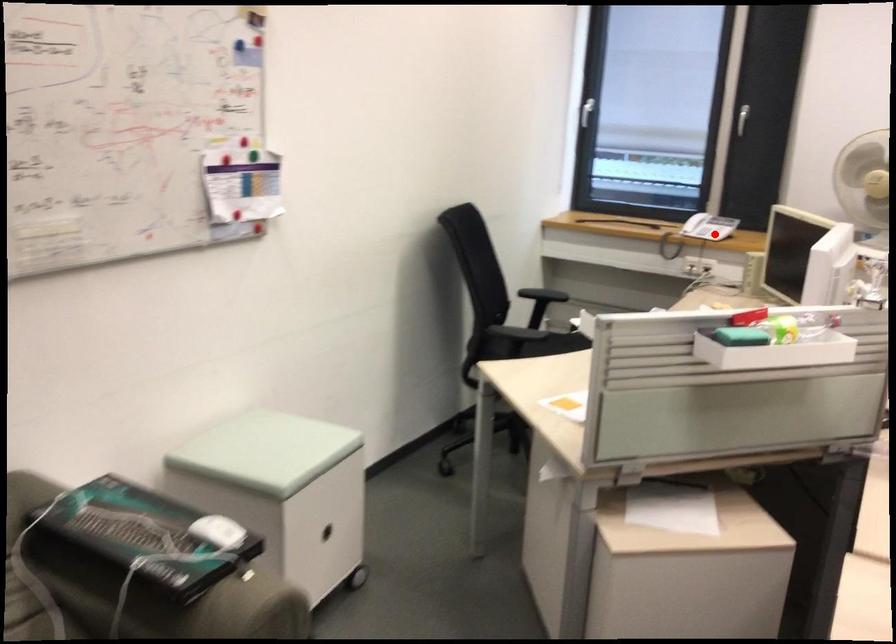
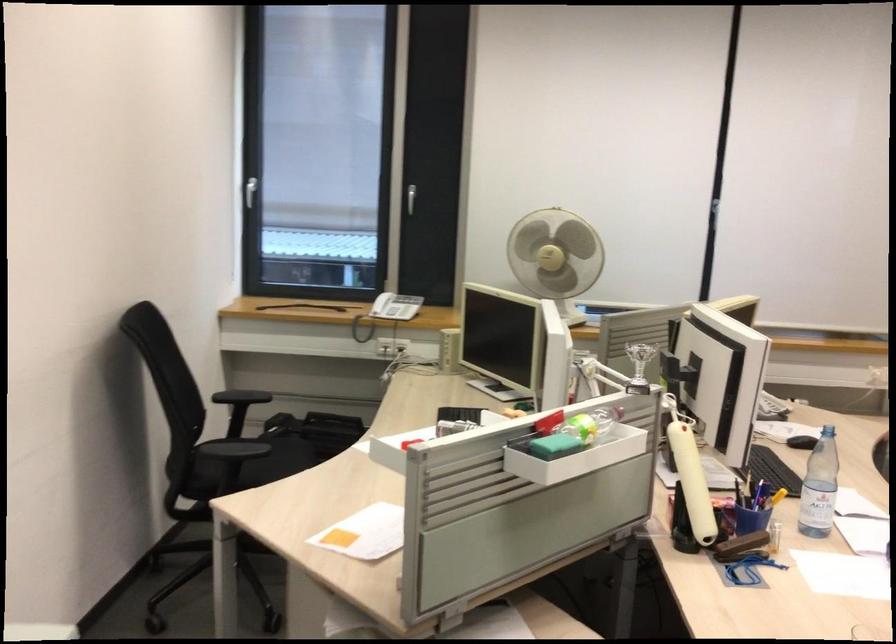
In the second image, find the point that corresponds to the highlighted location in the first image.

(386, 312)